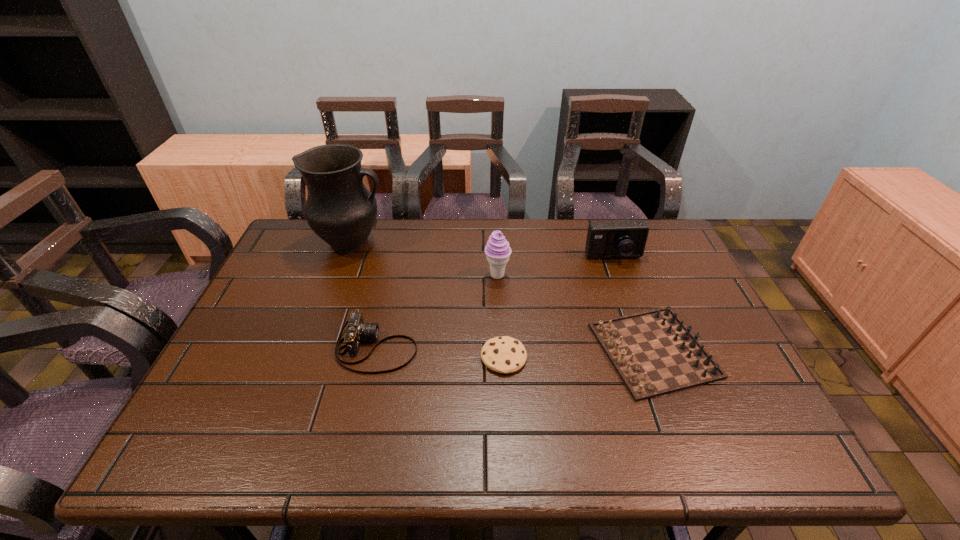
Where is `empty space between the shorter camera and the pitcher`? This screenshot has height=540, width=960. empty space between the shorter camera and the pitcher is located at coordinates (365, 295).

You are a GUI agent. You are given a task and a screenshot of the screen. Output one action in this format:
    pyautogui.click(x=<x>, y=<y>)
    Task: Click on the free spot between the chessboard and the cookie
    The width and height of the screenshot is (960, 540).
    Given the screenshot: What is the action you would take?
    pyautogui.click(x=579, y=354)

Locate an element on the screen. The image size is (960, 540). vacant space that's between the chessboard and the farther camera is located at coordinates (634, 304).

Locate an element on the screen. The height and width of the screenshot is (540, 960). free spot between the tallest object and the third farthest object is located at coordinates tap(424, 259).

This screenshot has height=540, width=960. I want to click on vacant area between the taller camera and the third farthest object, so click(555, 267).

This screenshot has height=540, width=960. In order to click on vacant area between the tallest object and the third farthest object in this screenshot , I will do `click(424, 259)`.

Where is `free space that is in between the shorter camera and the third farthest object`? free space that is in between the shorter camera and the third farthest object is located at coordinates (437, 311).

You are a GUI agent. You are given a task and a screenshot of the screen. Output one action in this format:
    pyautogui.click(x=<x>, y=<y>)
    Task: Click on the second closest object to the taller camera
    The height and width of the screenshot is (540, 960).
    Given the screenshot: What is the action you would take?
    click(x=497, y=250)

Select which object is the second closest to the fourth nearest object. Please provide its 2D coordinates. Your answer should be formatted as a tuple, i.e. [(x, y)], where the tuple contains the x and y coordinates of a point satisfying the conditions above.

[(654, 353)]

At what (x,y) coordinates should I click in order to perform the action: click on free space that satisfies the following two spatial constraints: 1. on the handle side of the pitcher; 2. on the right side of the chessboard. Please return your answer as a coordinate pair (x, y). Looking at the image, I should click on (312, 350).